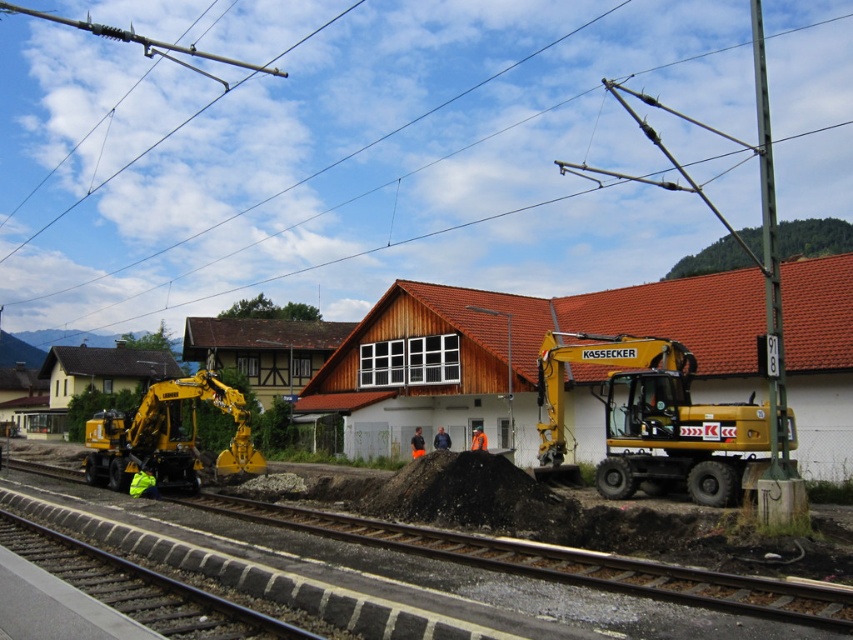
You are a construction worker needing to transport materials from the yellow metallic excavator at right to the gray gravel train track at lower left. Which object is narrower so you can choose the appropriate equipment for the task?

The yellow metallic excavator at right has a lesser width compared to the gray gravel train track at lower left, so you should choose equipment that can navigate through the narrower space of the yellow metallic excavator at right.

You are a construction worker standing on the platform. You need to lift a heavy object using the yellow metallic excavator at right. Can you safely operate it without hitting the gray gravel train track at lower left? Explain why.

The yellow metallic excavator at right is taller than the gray gravel train track at lower left. Since the excavator is taller, its boom and arm can safely extend over the track without making contact, allowing you to operate it without hitting the track.

Based on the given coordinates, where exactly is the yellow metallic excavator at right located in the image?

The yellow metallic excavator at right is located at point [653,420] in the image.